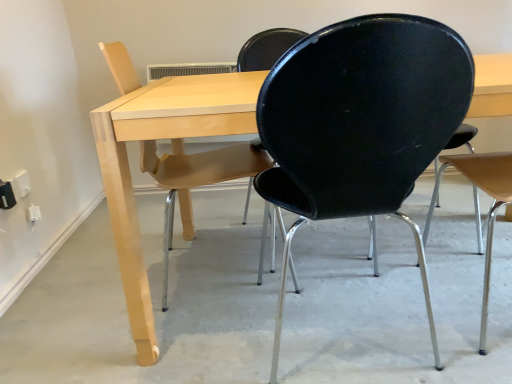
What are the coordinates of `vacant space behind black plastic chair at center, which ranks as the second chair in left-to-right order` in the screenshot? It's located at (331, 262).